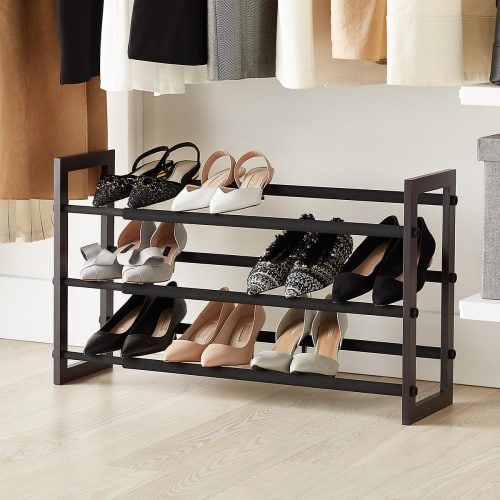
Where is `horizontal bars for shoes to rest on`? The image size is (500, 500). horizontal bars for shoes to rest on is located at coordinates (378, 389), (390, 351), (387, 312), (431, 277), (362, 231), (371, 197).